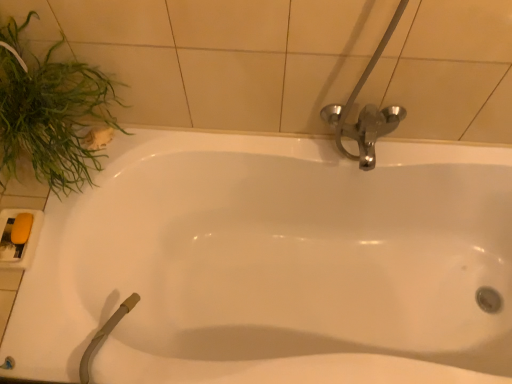
Question: Is yellow matte soap at lower left wider or thinner than green leafy plant at left?

Choices:
 (A) thin
 (B) wide

Answer: (A)

Question: Visually, is yellow matte soap at lower left positioned to the left or to the right of green leafy plant at left?

Choices:
 (A) left
 (B) right

Answer: (A)

Question: Estimate the real-world distances between objects in this image. Which object is closer to the white glossy bathtub at center?

Choices:
 (A) yellow matte soap at lower left
 (B) green leafy plant at left

Answer: (B)

Question: Which of these objects is positioned farthest from the yellow matte soap at lower left?

Choices:
 (A) green leafy plant at left
 (B) white glossy bathtub at center

Answer: (B)